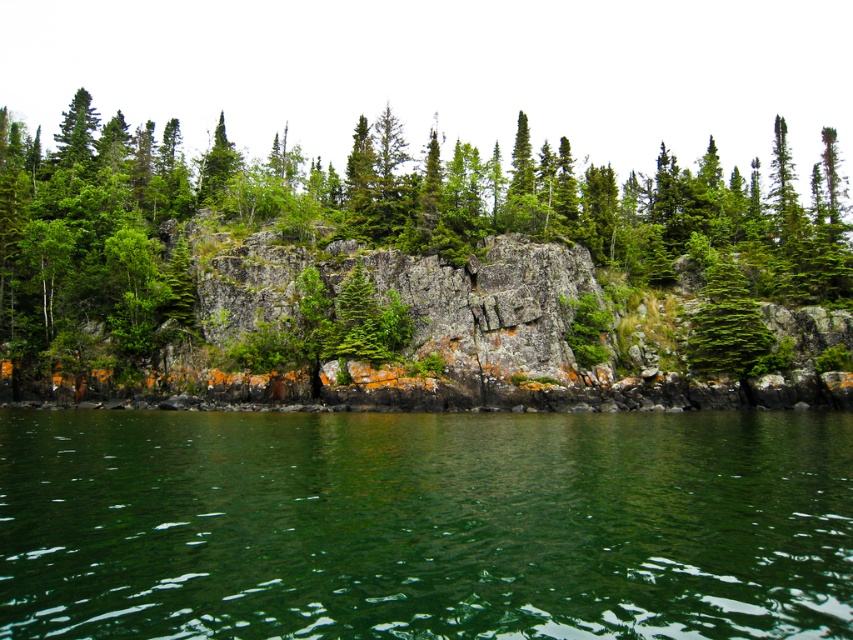
You are standing at the edge of the cliff and see the green liquid at lower center and the green matte tree at lower left. Which object is closer to your right side?

The green liquid at lower center is closer to your right side because it is positioned to the right of the green matte tree at lower left.

You are a hiker who wants to cross the green liquid at lower center. The green matte tree at lower left is nearby. Can you use the tree to help you cross the liquid?

The green liquid at lower center is shorter than the green matte tree at lower left, so the tree is taller. However, the liquid is a body of water and the tree is a plant, so you cannot use the tree to cross the liquid.

You are standing at the edge of the cliff and see a point marked at coordinates (424, 524). What is the color of the liquid located at that point?

The point at coordinates (424, 524) indicates green liquid at lower center, so the liquid there is green.